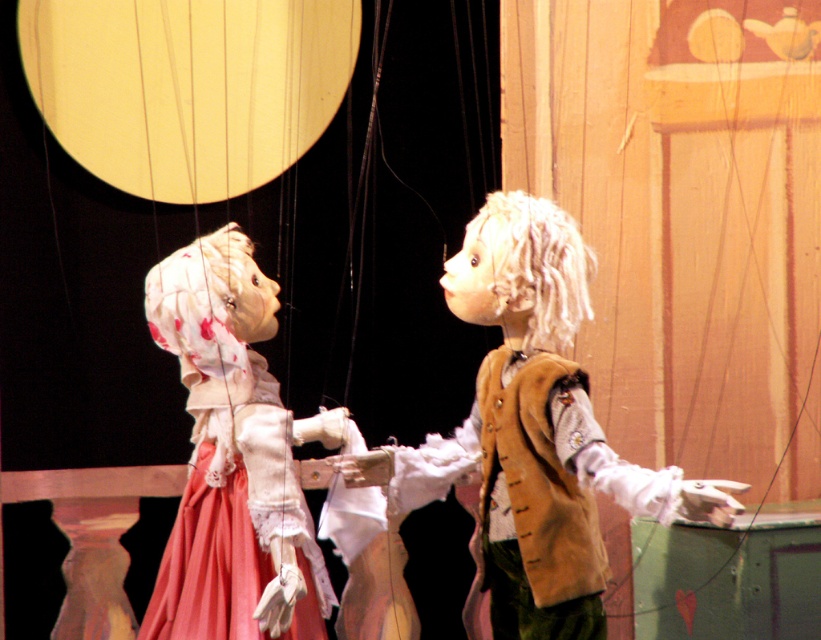
You are a puppeteer trying to position your puppet in the front of the stage. You have two points marked on the stage floor, point A at coordinates point(287, 545) and point B at coordinates point(535, 371). Which point should you move your puppet to if you want it to be in front of the other puppet?

You should move your puppet to point A at coordinates point(287, 545) because it is in front of point B at coordinates point(535, 371).

You are a puppeteer trying to adjust the positioning of the velvet brown vest at center and the matte white doll at left. Which object is located to the right of the other?

The velvet brown vest at center is positioned on the right side of matte white doll at left, so the velvet brown vest at center is to the right of the matte white doll at left.

You are a puppet designer who needs to choose between two vests for a new character. The scene shows a puppet show with two puppets wearing vests. The first puppet wears a velvet brown vest at center, and the second has a brown suede vest at center. Which vest is wider?

The velvet brown vest at center is wider than the brown suede vest at center according to the description.